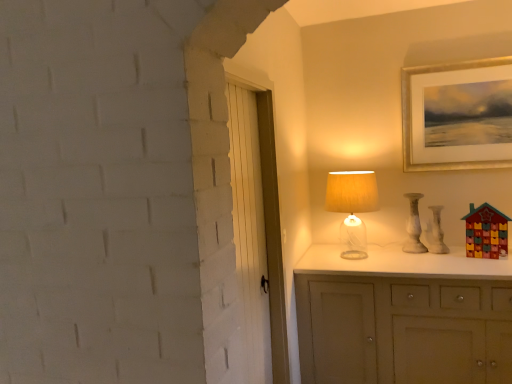
Question: Considering the relative sizes of gold-framed picture at upper right and translucent glass table lamp at upper right in the image provided, is gold-framed picture at upper right thinner than translucent glass table lamp at upper right?

Choices:
 (A) yes
 (B) no

Answer: (A)

Question: Is gold-framed picture at upper right facing away from translucent glass table lamp at upper right?

Choices:
 (A) no
 (B) yes

Answer: (A)

Question: Considering the relative sizes of gold-framed picture at upper right and translucent glass table lamp at upper right in the image provided, is gold-framed picture at upper right bigger than translucent glass table lamp at upper right?

Choices:
 (A) yes
 (B) no

Answer: (B)

Question: Is gold-framed picture at upper right taller than translucent glass table lamp at upper right?

Choices:
 (A) no
 (B) yes

Answer: (B)

Question: From the image's perspective, is gold-framed picture at upper right above translucent glass table lamp at upper right?

Choices:
 (A) yes
 (B) no

Answer: (A)

Question: Which is correct: translucent glass table lamp at upper right is inside wooden toy house at right, or outside of it?

Choices:
 (A) inside
 (B) outside

Answer: (B)

Question: In terms of height, does translucent glass table lamp at upper right look taller or shorter compared to wooden toy house at right?

Choices:
 (A) tall
 (B) short

Answer: (A)

Question: Looking at the image, does translucent glass table lamp at upper right seem bigger or smaller compared to wooden toy house at right?

Choices:
 (A) small
 (B) big

Answer: (B)

Question: From the image's perspective, is translucent glass table lamp at upper right positioned above or below wooden toy house at right?

Choices:
 (A) below
 (B) above

Answer: (B)

Question: Is white painted wood door at center wider or thinner than white marble vase at right?

Choices:
 (A) thin
 (B) wide

Answer: (A)

Question: In the image, is white painted wood door at center positioned in front of or behind white marble vase at right?

Choices:
 (A) behind
 (B) front

Answer: (B)

Question: From a real-world perspective, is white painted wood door at center physically located above or below white marble vase at right?

Choices:
 (A) above
 (B) below

Answer: (A)

Question: Considering the positions of point (193, 170) and point (437, 205), is point (193, 170) closer or farther from the camera than point (437, 205)?

Choices:
 (A) closer
 (B) farther

Answer: (A)

Question: Considering the positions of translucent glass table lamp at upper right and white marble vase at right in the image, is translucent glass table lamp at upper right wider or thinner than white marble vase at right?

Choices:
 (A) thin
 (B) wide

Answer: (B)

Question: In terms of size, does translucent glass table lamp at upper right appear bigger or smaller than white marble vase at right?

Choices:
 (A) big
 (B) small

Answer: (A)